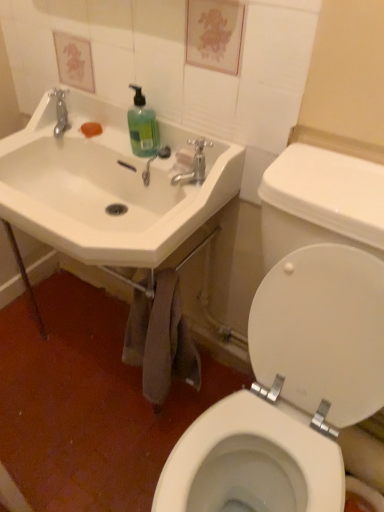
Question: Is green matte liquid soap at upper center situated inside white glossy toilet lid at right or outside?

Choices:
 (A) inside
 (B) outside

Answer: (B)

Question: From a real-world perspective, is green matte liquid soap at upper center above or below white glossy toilet lid at right?

Choices:
 (A) below
 (B) above

Answer: (B)

Question: Which is nearer to the matte silver faucet at upper center?

Choices:
 (A) white ceramic sink at upper left
 (B) translucent plastic faucet at upper center
 (C) white glossy toilet lid at right
 (D) green matte liquid soap at upper center

Answer: (B)

Question: Estimate the real-world distances between objects in this image. Which object is farther from the white ceramic sink at upper left?

Choices:
 (A) matte silver faucet at upper center
 (B) white glossy toilet lid at right
 (C) translucent plastic faucet at upper center
 (D) green matte liquid soap at upper center

Answer: (B)